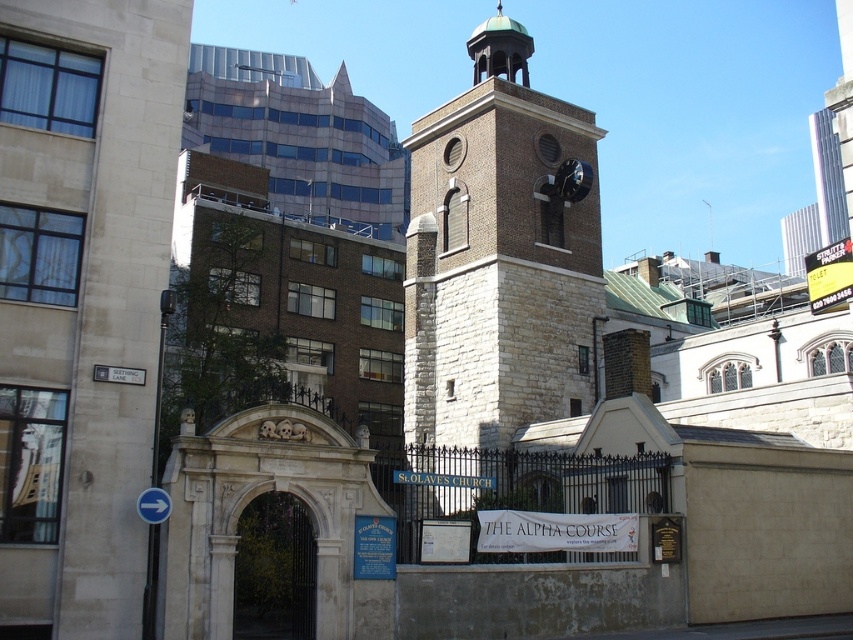
You are standing in front of St Olave Church and want to take a photo of both the stone clock tower at center and the green copper bell tower at center. Which tower should you position closer to the camera to ensure both are fully visible in the frame?

The stone clock tower at center is wider than the green copper bell tower at center, so you should position the stone clock tower at center closer to the camera to ensure both are fully visible in the frame.

Looking at this image, you are standing at the entrance of St Olave Church and want to take a photo of the green copper bell tower at center. If you move 0.1 units to the right along the x axis, will the bell tower still be in your frame?

The green copper bell tower at center is located at point (498, 49). Moving 0.1 units to the right along the x axis would bring the camera to approximately (498, 113). Since the bell tower is at 0.077, it would still be within the frame unless the camera movement exceeds the field of view. However, without specific field of view details, it is assumed the tower remains visible.